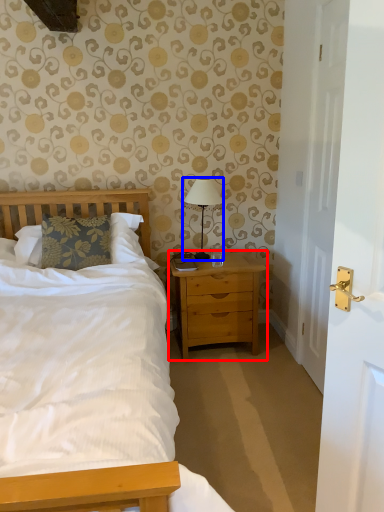
Question: Which object appears closest to the camera in this image, nightstand (highlighted by a red box) or bedside lamp (highlighted by a blue box)?

Choices:
 (A) nightstand
 (B) bedside lamp

Answer: (A)